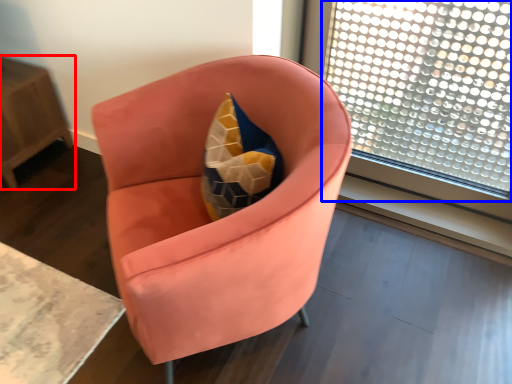
Question: Which of the following is the farthest to the observer, table (highlighted by a red box) or window (highlighted by a blue box)?

Choices:
 (A) table
 (B) window

Answer: (A)